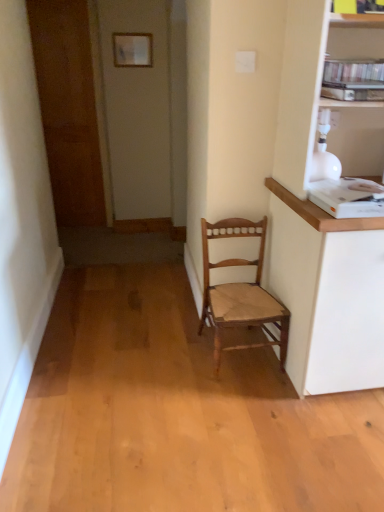
Question: From the image's perspective, is white paper at upper center over wooden chair at center?

Choices:
 (A) no
 (B) yes

Answer: (B)

Question: Considering the relative positions of white paper at upper center and wooden chair at center in the image provided, is white paper at upper center to the left of wooden chair at center from the viewer's perspective?

Choices:
 (A) yes
 (B) no

Answer: (A)

Question: Can you confirm if white paper at upper center is shorter than wooden chair at center?

Choices:
 (A) yes
 (B) no

Answer: (A)

Question: Can you see white paper at upper center touching wooden chair at center?

Choices:
 (A) yes
 (B) no

Answer: (B)

Question: From a real-world perspective, is white paper at upper center located higher than wooden chair at center?

Choices:
 (A) yes
 (B) no

Answer: (A)

Question: Considering the positions of wooden chair at center and brown wooden door at left in the image, is wooden chair at center bigger or smaller than brown wooden door at left?

Choices:
 (A) small
 (B) big

Answer: (A)

Question: From the image's perspective, is wooden chair at center above or below brown wooden door at left?

Choices:
 (A) above
 (B) below

Answer: (B)

Question: Looking at their shapes, would you say wooden chair at center is wider or thinner than brown wooden door at left?

Choices:
 (A) thin
 (B) wide

Answer: (B)

Question: Do you think wooden chair at center is within brown wooden door at left, or outside of it?

Choices:
 (A) outside
 (B) inside

Answer: (A)

Question: Is white paper at upper center taller or shorter than wooden chair at center?

Choices:
 (A) tall
 (B) short

Answer: (B)

Question: Choose the correct answer: Is white paper at upper center inside wooden chair at center or outside it?

Choices:
 (A) inside
 (B) outside

Answer: (B)

Question: Based on their positions, is white paper at upper center located to the left or right of wooden chair at center?

Choices:
 (A) left
 (B) right

Answer: (A)

Question: Is point (135, 35) positioned closer to the camera than point (256, 292)?

Choices:
 (A) farther
 (B) closer

Answer: (A)

Question: From a real-world perspective, is white paper at upper center positioned above or below brown wooden door at left?

Choices:
 (A) below
 (B) above

Answer: (B)

Question: Considering the positions of point (140, 39) and point (48, 10), is point (140, 39) closer or farther from the camera than point (48, 10)?

Choices:
 (A) farther
 (B) closer

Answer: (B)